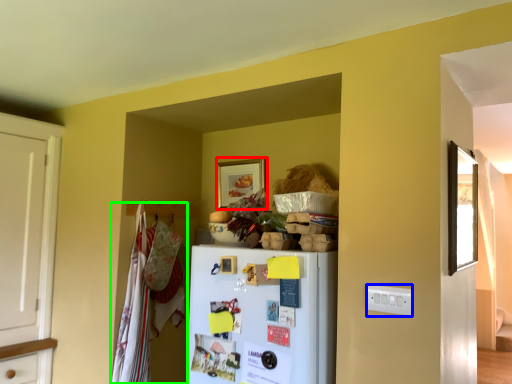
Question: Estimate the real-world distances between objects in this image. Which object is farther from picture frame (highlighted by a red box), electric outlet (highlighted by a blue box) or laundry (highlighted by a green box)?

Choices:
 (A) electric outlet
 (B) laundry

Answer: (A)